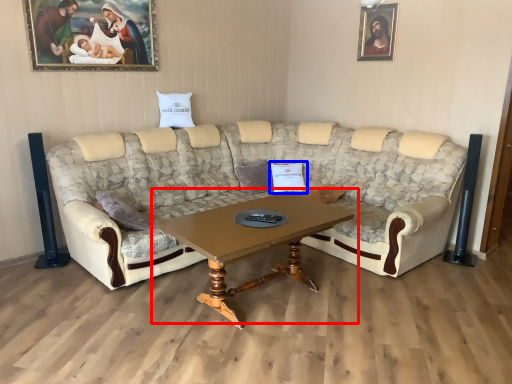
Question: Which of the following is the closest to the observer, coffee table (highlighted by a red box) or pillow (highlighted by a blue box)?

Choices:
 (A) coffee table
 (B) pillow

Answer: (A)